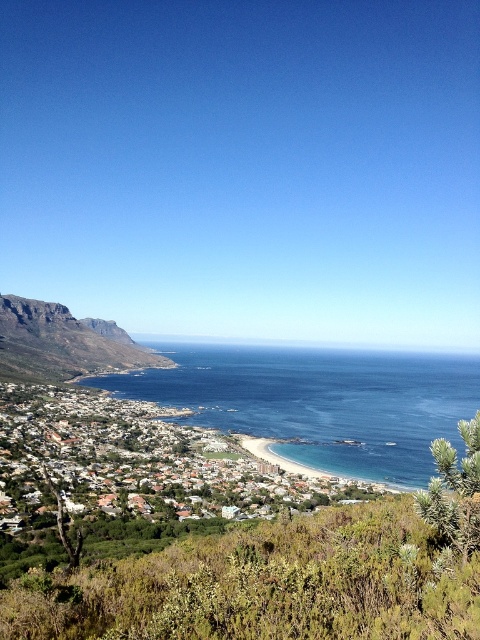
Question: Which is nearer to the white matte houses at center?

Choices:
 (A) blue water at center
 (B) rugged stone mountain at left

Answer: (A)

Question: Is blue water at center below rugged stone mountain at left?

Choices:
 (A) yes
 (B) no

Answer: (A)

Question: Can you confirm if blue water at center is wider than white matte houses at center?

Choices:
 (A) no
 (B) yes

Answer: (B)

Question: Is white matte houses at center wider than rugged stone mountain at left?

Choices:
 (A) yes
 (B) no

Answer: (B)

Question: Which point is farther to the camera?

Choices:
 (A) rugged stone mountain at left
 (B) white matte houses at center
 (C) blue water at center

Answer: (A)

Question: Among these objects, which one is farthest from the camera?

Choices:
 (A) blue water at center
 (B) white matte houses at center

Answer: (B)